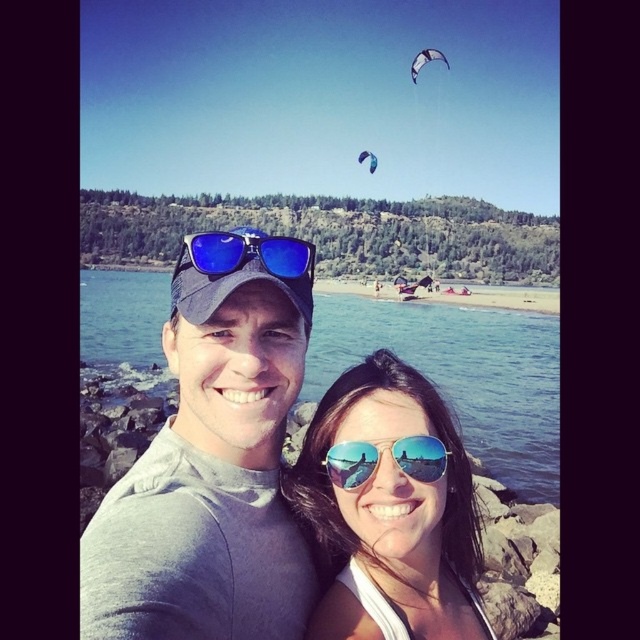
Question: Which is nearer to the white fabric kite at upper center?

Choices:
 (A) blue glossy kite at upper center
 (B) shiny reflective sunglasses at center
 (C) clear blue water at center

Answer: (A)

Question: Which of the following is the closest to the observer?

Choices:
 (A) gray matte t-shirt at center
 (B) clear blue water at center

Answer: (A)

Question: Among these objects, which one is nearest to the camera?

Choices:
 (A) shiny reflective sunglasses at center
 (B) gray matte t-shirt at center
 (C) gold reflective sunglasses at center
 (D) clear blue water at center

Answer: (B)

Question: Does blue reflective sunglasses at center appear on the left side of gold reflective sunglasses at center?

Choices:
 (A) no
 (B) yes

Answer: (B)

Question: Is clear blue water at center further to the viewer compared to blue reflective sunglasses at center?

Choices:
 (A) no
 (B) yes

Answer: (B)

Question: Is shiny reflective sunglasses at center thinner than clear blue water at center?

Choices:
 (A) no
 (B) yes

Answer: (B)